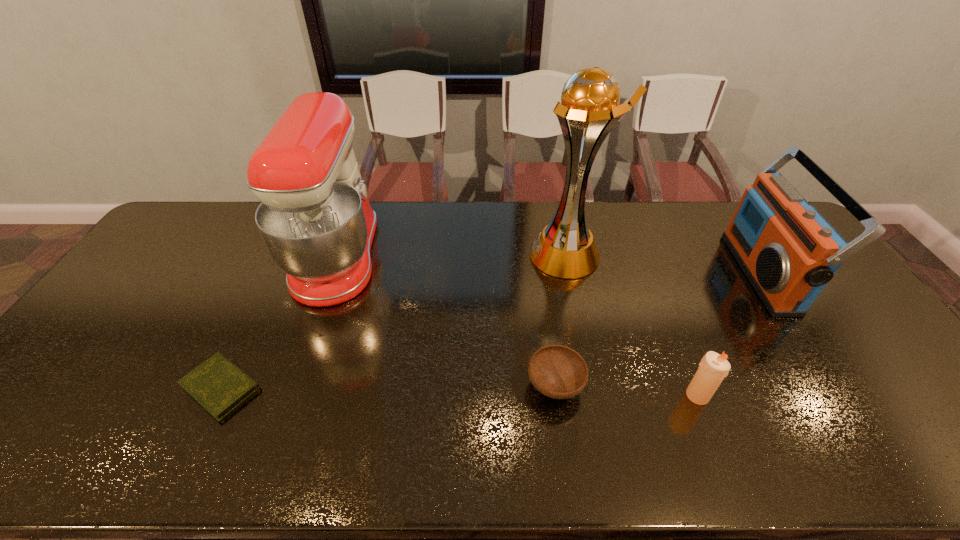
Where is `free spot between the rightmost object and the diary`? The width and height of the screenshot is (960, 540). free spot between the rightmost object and the diary is located at coordinates (492, 330).

Where is `vacant area that lies between the mixer and the second shortest object`? This screenshot has width=960, height=540. vacant area that lies between the mixer and the second shortest object is located at coordinates (446, 321).

I want to click on empty location between the second shortest object and the trophy, so click(561, 320).

Identify the location of empty location between the candle and the fifth shortest object. (517, 326).

Where is `free space between the mixer and the bowl`? The image size is (960, 540). free space between the mixer and the bowl is located at coordinates (446, 321).

This screenshot has height=540, width=960. In order to click on free space between the trophy and the shortest object in this screenshot , I will do `click(394, 321)`.

I want to click on object that is the closest to the third shortest object, so click(559, 372).

Find the location of a particular element. object that is the third closest to the diary is located at coordinates (589, 109).

You are a GUI agent. You are given a task and a screenshot of the screen. Output one action in this format:
    pyautogui.click(x=<x>, y=<y>)
    Task: Click on the free location that satisfies the following two spatial constraints: 1. on the front-facing side of the rightmost object; 2. on the front side of the fifth tallest object
    This screenshot has height=540, width=960.
    Given the screenshot: What is the action you would take?
    (x=836, y=386)

Find the location of a particular element. vacant space that satisfies the following two spatial constraints: 1. on the front-facing side of the mixer; 2. on the left side of the second object from right to left is located at coordinates (290, 395).